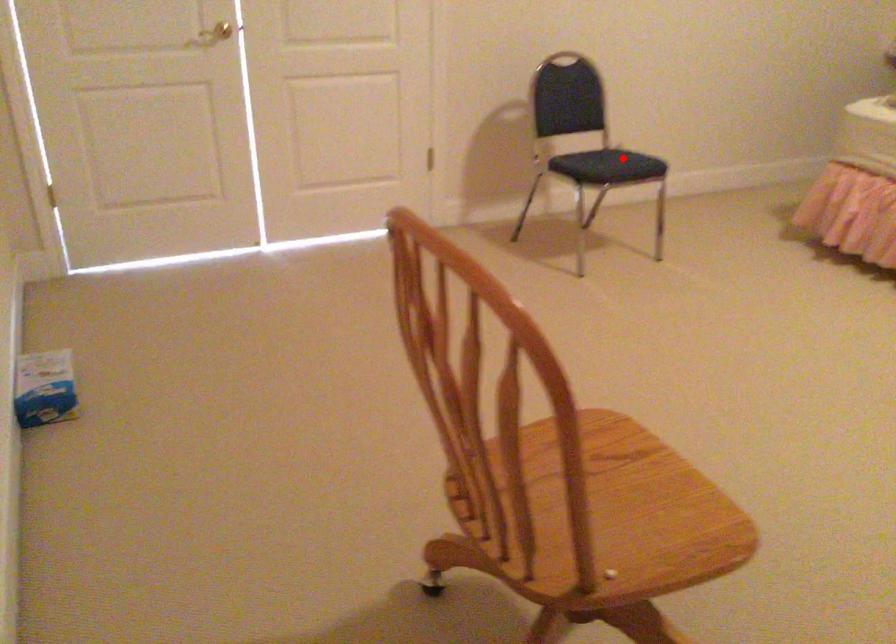
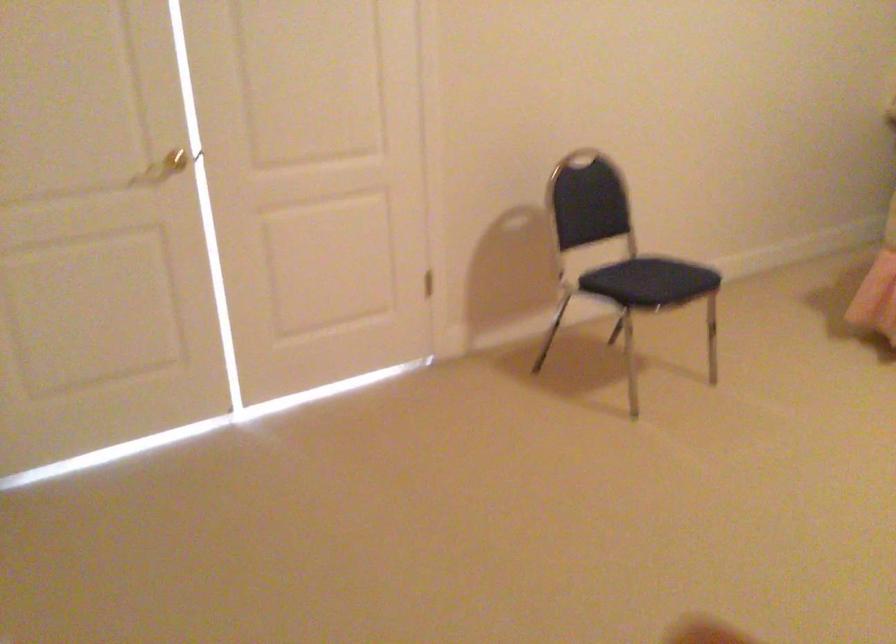
Question: I am providing you with two images of the same scene from different viewpoints. In image1, a red point is highlighted. Considering the same 3D point in image2, which of the following is correct?

Choices:
 (A) It is closer
 (B) It is farther

Answer: (A)